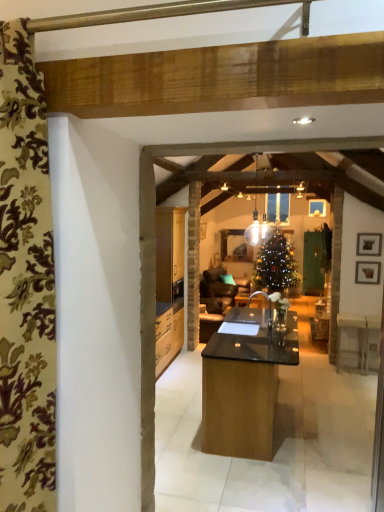
Question: Is black matte picture frame at upper right, the 2th picture frame positioned from the bottom, to the left or to the right of translucent glass pendant light at center in the image?

Choices:
 (A) right
 (B) left

Answer: (A)

Question: Looking at the image, does black matte picture frame at upper right, the 2th picture frame positioned from the bottom, seem bigger or smaller compared to translucent glass pendant light at center?

Choices:
 (A) big
 (B) small

Answer: (B)

Question: Which is farther from the black matte picture frame at upper right, the 2th picture frame positioned from the bottom?

Choices:
 (A) floral fabric curtain at left
 (B) wooden picture frame at right, the first picture frame in the bottom-to-top sequence
 (C) translucent glass pendant light at center

Answer: (A)

Question: Which object is the farthest from the translucent glass pendant light at center?

Choices:
 (A) wooden picture frame at right, which is the 2th picture frame from top to bottom
 (B) floral fabric curtain at left
 (C) black matte picture frame at upper right, the 2th picture frame positioned from the bottom

Answer: (B)